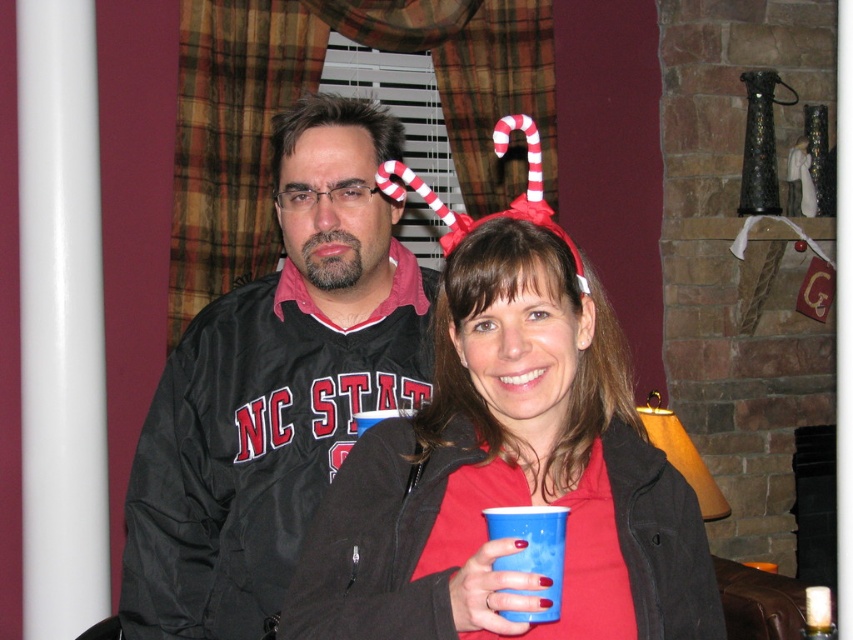
Based on the photo, can you confirm if matte plastic cup at center is thinner than black matte jacket at center?

No.

Does matte plastic cup at center have a larger size compared to black matte jacket at center?

Incorrect, matte plastic cup at center is not larger than black matte jacket at center.

Is point (444, 372) farther from viewer compared to point (146, 586)?

No, it is not.

Find the location of a particular element. The image size is (853, 640). matte plastic cup at center is located at coordinates (509, 476).

Can you confirm if blue plastic cup at lower center is positioned below white striped fabric candy cane at upper center?

Correct, blue plastic cup at lower center is located below white striped fabric candy cane at upper center.

Is blue plastic cup at lower center shorter than white striped fabric candy cane at upper center?

Yes.

Is point (526, 566) less distant than point (495, 140)?

That is True.

Where is `blue plastic cup at lower center`? blue plastic cup at lower center is located at coordinates (531, 552).

Can you confirm if matte plastic cup at center is shorter than blue plastic cup at lower center?

In fact, matte plastic cup at center may be taller than blue plastic cup at lower center.

Can you confirm if matte plastic cup at center is positioned to the right of blue plastic cup at lower center?

Correct, you'll find matte plastic cup at center to the right of blue plastic cup at lower center.

Describe the element at coordinates (509, 476) in the screenshot. I see `matte plastic cup at center` at that location.

Identify the location of matte plastic cup at center. (509, 476).